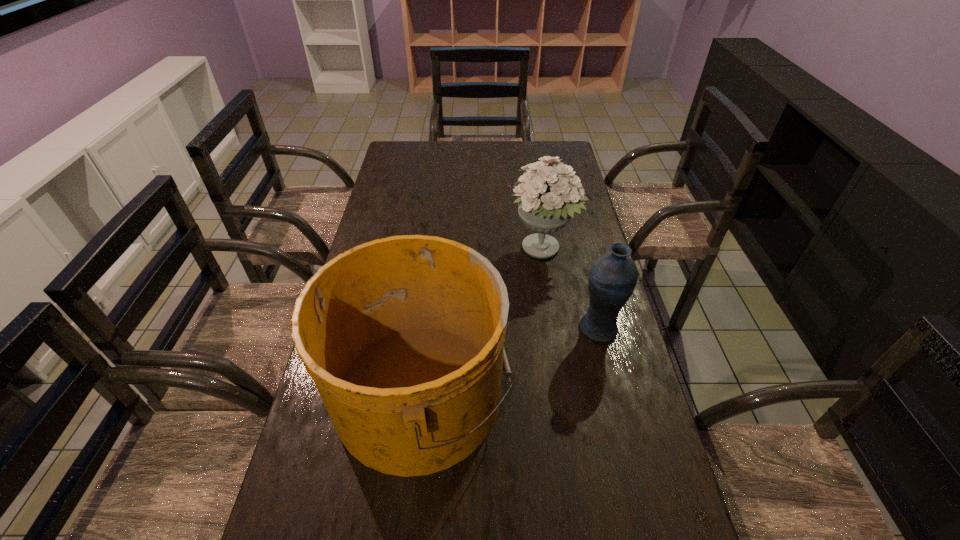
In the image, there is a desktop. Identify the location of vacant space at the left edge. (361, 471).

This screenshot has height=540, width=960. In the image, there is a desktop. Find the location of `vacant space at the right edge`. vacant space at the right edge is located at coordinates (620, 320).

The image size is (960, 540). I want to click on free location at the far right corner, so click(565, 153).

This screenshot has width=960, height=540. Find the location of `empty space that is in between the farthest object and the vase`. empty space that is in between the farthest object and the vase is located at coordinates (571, 289).

Locate an element on the screen. The width and height of the screenshot is (960, 540). vacant space in between the bucket and the vase is located at coordinates (510, 360).

This screenshot has width=960, height=540. In order to click on blank region between the leftmost object and the vase in this screenshot , I will do `click(510, 360)`.

The width and height of the screenshot is (960, 540). I want to click on free space that is in between the vase and the farthest object, so click(571, 289).

Where is `vacant area that lies between the farthest object and the vase`? The image size is (960, 540). vacant area that lies between the farthest object and the vase is located at coordinates (571, 289).

You are a GUI agent. You are given a task and a screenshot of the screen. Output one action in this format:
    pyautogui.click(x=<x>, y=<y>)
    Task: Click on the free area in between the farthest object and the vase
    This screenshot has height=540, width=960.
    Given the screenshot: What is the action you would take?
    pyautogui.click(x=571, y=289)

Where is `free space between the vase and the bucket`? This screenshot has width=960, height=540. free space between the vase and the bucket is located at coordinates (510, 360).